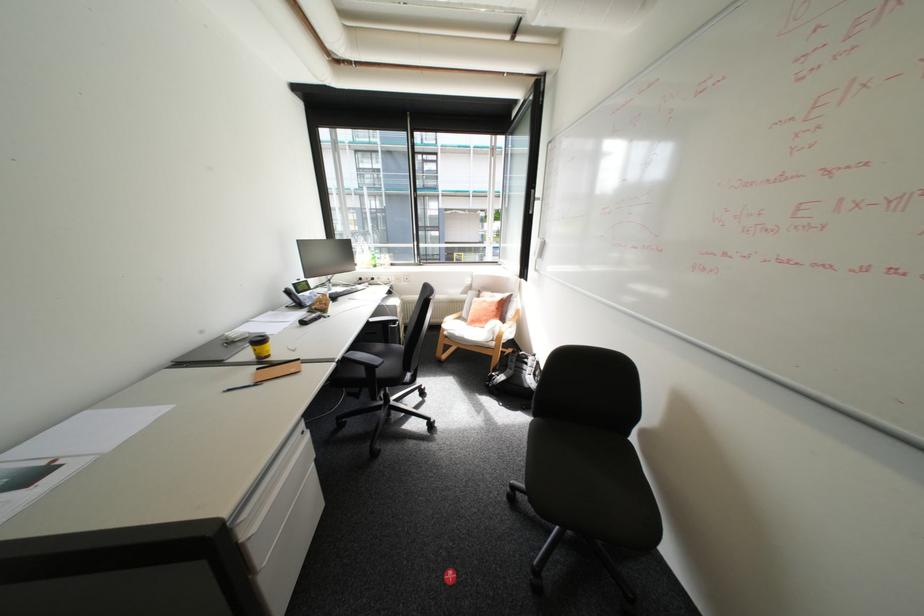
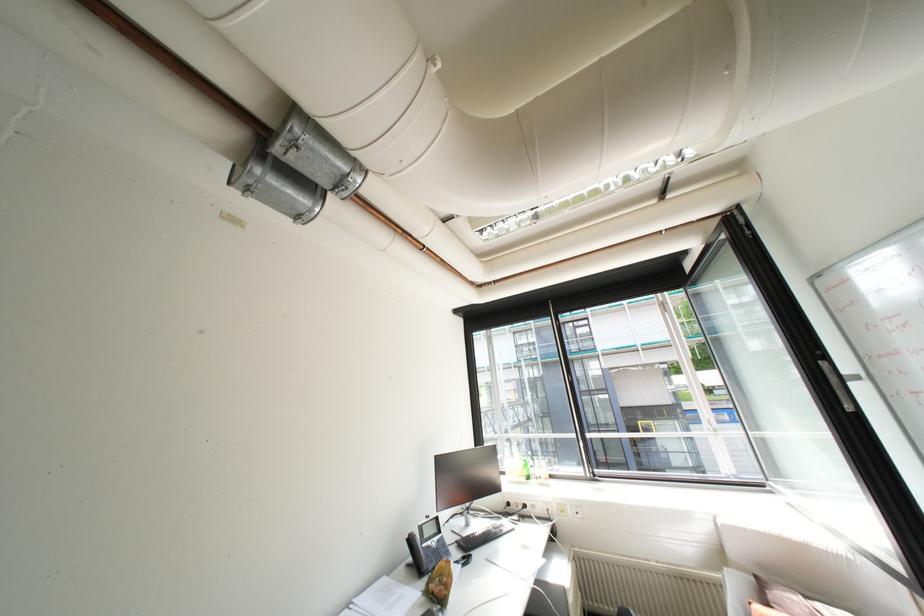
Based on the continuous images, in which direction is the camera rotating?

The camera rotated toward left-up.